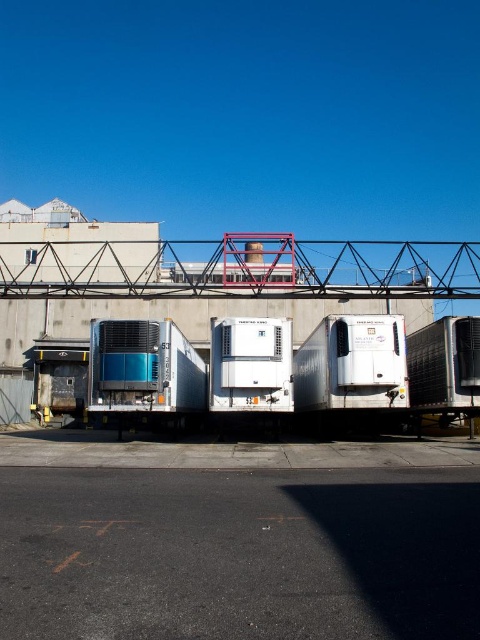
You are a delivery driver who needs to cross the metallic red bridge at upper center to reach your destination. Your truck has a height of 13.5 feet. Can your truck safely pass under the bridge without hitting it?

The metallic red bridge at upper center is 78.22 feet from camera. However, the height clearance of the bridge is not provided in the scene description or object details. Therefore, it is impossible to determine if the truck can safely pass under the bridge based on the given information.

You are a truck driver planning to cross the metallic red bridge at upper center with your metallic blue trailer truck at center. Given the bridge width, will your truck fit comfortably without touching the sides?

The metallic red bridge at upper center is wider than the metallic blue trailer truck at center, so the truck should fit comfortably without touching the sides.

Consider the image. You are a truck driver who needs to position your metallic blue trailer truck at center so that it aligns with the entrance of the metallic red bridge at upper center. Based on the scene description, which direction should you move your truck to align with the bridge?

The metallic red bridge at upper center is to the right of the metallic blue trailer truck at center. To align with the bridge, the driver should move the metallic blue trailer truck at center to the left so that it lines up with the entrance of the metallic red bridge at upper center.